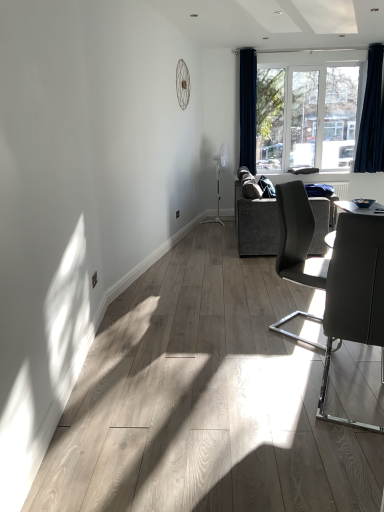
This screenshot has width=384, height=512. In order to click on vacant space in front of matte gray chair at center right, which appears as the second chair when viewed from the front in this screenshot , I will do `click(293, 359)`.